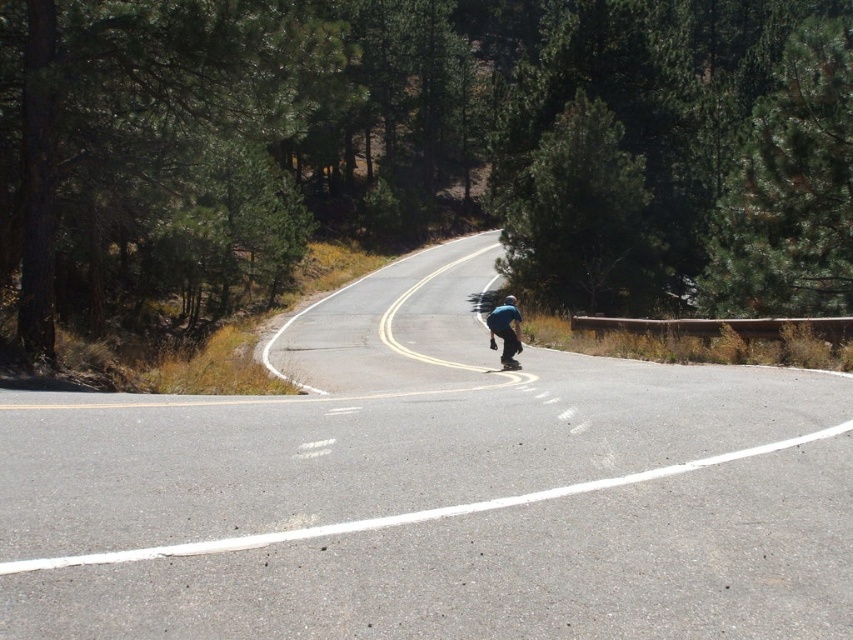
You are a cyclist approaching a curve on a road bordered by a low concrete barrier on the right. You notice a green leafy tree at left at point (154, 150). Can you safely pass a car coming from the opposite direction at this curve?

The green leafy tree at left is located at point (154, 150), which is on the left side of the road. Since the road has a low concrete barrier on the right and curves to the right, there is likely insufficient space to safely pass an oncoming car at this curve.

You are a cyclist approaching a bend in the forest road. You see a green leafy tree at left and a black smooth skateboard at center. Which object is higher relative to the skateboard?

The green leafy tree at left is above the black smooth skateboard at center, so the tree is higher.